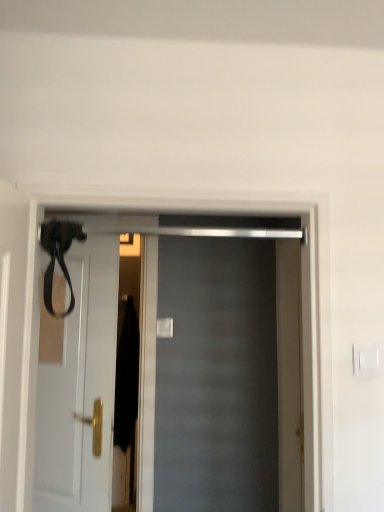
Question: Looking at their shapes, would you say white matte door at left, which ranks as the second door in front-to-back order, is wider or thinner than matte black door at center, which is the 1th door in right-to-left order?

Choices:
 (A) thin
 (B) wide

Answer: (A)

Question: Considering the positions of point (79, 318) and point (228, 490), is point (79, 318) closer or farther from the camera than point (228, 490)?

Choices:
 (A) farther
 (B) closer

Answer: (B)

Question: From the image's perspective, is white matte door at left, placed as the 1th door when sorted from left to right, located above or below matte black door at center, positioned as the 1th door in front-to-back order?

Choices:
 (A) below
 (B) above

Answer: (A)

Question: From the image's perspective, is matte black door at center, which is the 1th door in right-to-left order, above or below white matte door at left, the 1th door when ordered from back to front?

Choices:
 (A) above
 (B) below

Answer: (A)

Question: Is matte black door at center, positioned as the 1th door in front-to-back order, inside or outside of white matte door at left, marked as the 2th door in a right-to-left arrangement?

Choices:
 (A) inside
 (B) outside

Answer: (B)

Question: Is matte black door at center, which is the 1th door in right-to-left order, in front of or behind white matte door at left, marked as the 2th door in a right-to-left arrangement, in the image?

Choices:
 (A) behind
 (B) front

Answer: (B)

Question: In the image, is matte black door at center, arranged as the 2th door when viewed from the back, on the left side or the right side of white matte door at left, placed as the 1th door when sorted from left to right?

Choices:
 (A) right
 (B) left

Answer: (A)